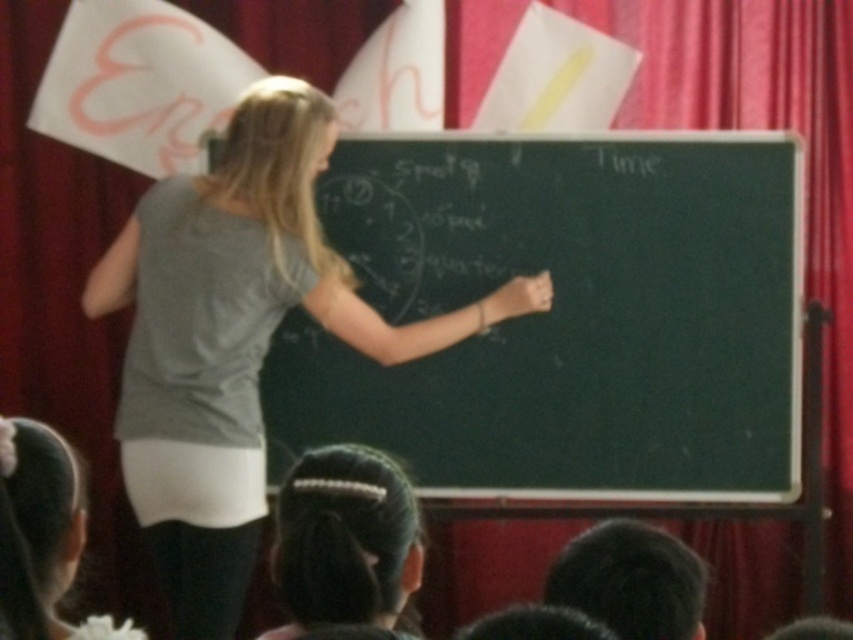
Question: Is the position of black chalkboard at center less distant than that of black hair at lower center?

Choices:
 (A) yes
 (B) no

Answer: (B)

Question: Which is nearer to the black chalkboard at center?

Choices:
 (A) gray fabric shirt at center
 (B) black hair at lower center

Answer: (A)

Question: Which object is positioned farthest from the gray fabric shirt at center?

Choices:
 (A) black chalkboard at center
 (B) black hair at lower center

Answer: (B)

Question: Which point is closer to the camera?

Choices:
 (A) black chalkboard at center
 (B) black hair at lower center

Answer: (B)

Question: Does black chalkboard at center have a greater width compared to black hair at lower center?

Choices:
 (A) no
 (B) yes

Answer: (B)

Question: Considering the relative positions of black chalkboard at center and black hair at lower center in the image provided, where is black chalkboard at center located with respect to black hair at lower center?

Choices:
 (A) right
 (B) left

Answer: (A)